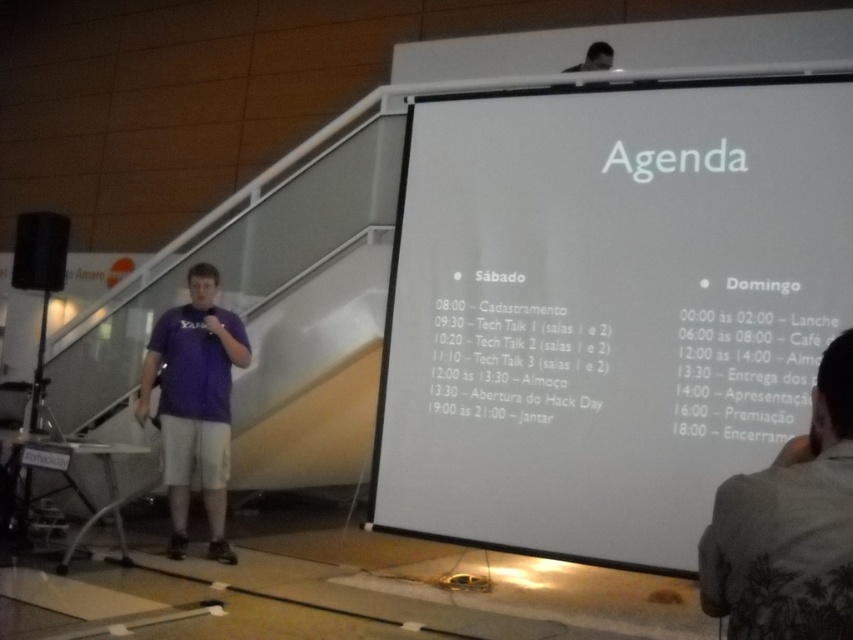
You are an attendee at the event and you want to check the schedule for Tech Talk 3. The white paper at upper center and gray cotton shirt at lower right are in your line of sight. Which object is blocking your view of the other?

The white paper at upper center is positioned over gray cotton shirt at lower right, so the white paper at upper center is blocking the view of the gray cotton shirt at lower right.

You are attending a tech conference and want to check the schedule for Tech Talk 1. You see the white paper at upper center. Can you read the details of Tech Talk 1 from where you are standing?

The white paper at upper center is 3.04 meters away from the viewer. Since the font is simple and legible, it is likely possible to read the details of Tech Talk 1 from that distance.

You are a photographer standing at the back of the conference hall. You need to take a photo of both the gray cotton shirt at lower right and the purple fabric shirt at center. The camera you are using has a maximum focus range of 3 meters. Can you capture both subjects in focus without moving closer?

The distance between the gray cotton shirt at lower right and the purple fabric shirt at center is 3.45 meters. Since the camera can only focus up to 3 meters, the subjects are slightly out of the focus range. You might need to adjust your position or use a different camera setting to ensure both are in focus.